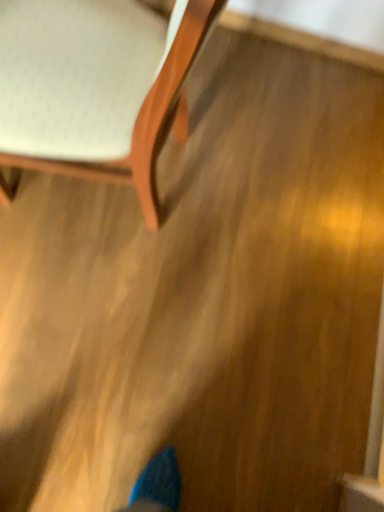
Locate an element on the screen. vacant area that lies in front of wooden chair at upper left is located at coordinates (70, 311).